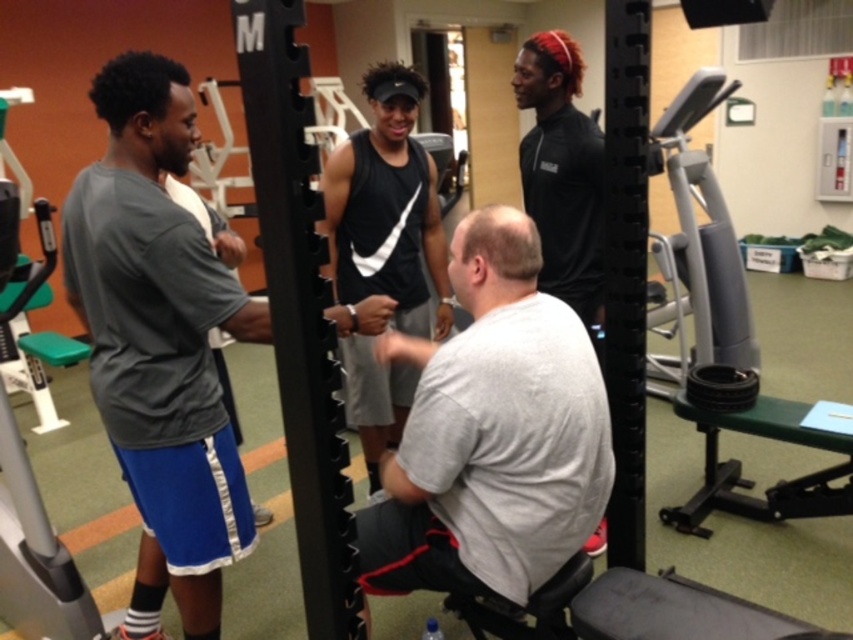
Question: Which object is farther from the camera taking this photo?

Choices:
 (A) black matte shirt at upper right
 (B) black matte tank top at center

Answer: (B)

Question: Which of the following is the farthest from the observer?

Choices:
 (A) (148, 464)
 (B) (503, 301)
 (C) (352, 424)

Answer: (C)

Question: Can you confirm if gray fabric squat at center is bigger than black matte tank top at center?

Choices:
 (A) no
 (B) yes

Answer: (A)

Question: Is gray fabric shirt at left behind black matte tank top at center?

Choices:
 (A) no
 (B) yes

Answer: (A)

Question: Estimate the real-world distances between objects in this image. Which object is closer to the black matte tank top at center?

Choices:
 (A) gray fabric squat at center
 (B) black matte shirt at upper right
 (C) gray fabric shirt at left

Answer: (B)

Question: Does gray fabric squat at center lie behind black matte tank top at center?

Choices:
 (A) yes
 (B) no

Answer: (B)